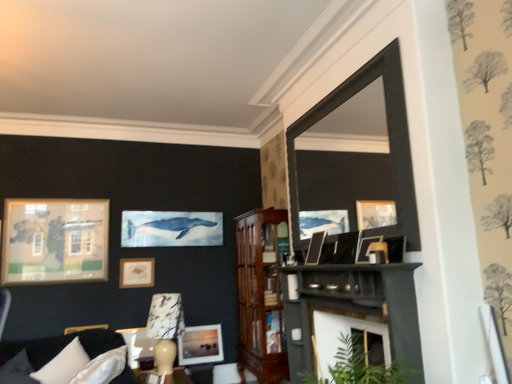
Question: Is matte black picture frame at upper center, the fifth picture frame from the bottom, taller than matte black picture frame at center, arranged as the 4th picture frame when viewed from the back?

Choices:
 (A) no
 (B) yes

Answer: (A)

Question: Can you confirm if matte black picture frame at upper center, the 5th picture frame in the left-to-right sequence, is positioned to the left of matte black picture frame at center, positioned as the second picture frame in right-to-left order?

Choices:
 (A) yes
 (B) no

Answer: (B)

Question: From the image's perspective, is matte black picture frame at upper center, which is counted as the 1th picture frame, starting from the top, on top of matte black picture frame at center, arranged as the 4th picture frame when viewed from the back?

Choices:
 (A) yes
 (B) no

Answer: (A)

Question: From a real-world perspective, is matte black picture frame at upper center, the 5th picture frame in the left-to-right sequence, on top of matte black picture frame at center, positioned as the second picture frame in front-to-back order?

Choices:
 (A) no
 (B) yes

Answer: (A)

Question: Can we say matte black picture frame at upper center, positioned as the 1th picture frame in front-to-back order, lies outside matte black picture frame at center, positioned as the second picture frame in right-to-left order?

Choices:
 (A) no
 (B) yes

Answer: (B)

Question: Considering the relative sizes of matte black picture frame at upper center, the fifth picture frame from the bottom, and matte black picture frame at center, which is the 4th picture frame from left to right, in the image provided, is matte black picture frame at upper center, the fifth picture frame from the bottom, wider than matte black picture frame at center, which is the 4th picture frame from left to right,?

Choices:
 (A) yes
 (B) no

Answer: (A)

Question: Is matte glass picture frame at center, the second picture frame positioned from the left, aimed at matte black picture frame at center, which is counted as the fourth picture frame, starting from the bottom?

Choices:
 (A) no
 (B) yes

Answer: (B)

Question: From a real-world perspective, is matte glass picture frame at center, acting as the 4th picture frame starting from the right, positioned under matte black picture frame at center, which is counted as the fourth picture frame, starting from the bottom, based on gravity?

Choices:
 (A) yes
 (B) no

Answer: (A)

Question: Does matte glass picture frame at center, which is the fifth picture frame from top to bottom, have a smaller size compared to matte black picture frame at center, which is counted as the fourth picture frame, starting from the bottom?

Choices:
 (A) yes
 (B) no

Answer: (B)

Question: Is matte black picture frame at center, arranged as the 4th picture frame when viewed from the back, at the back of matte glass picture frame at center, the second picture frame positioned from the left?

Choices:
 (A) yes
 (B) no

Answer: (B)

Question: Are matte glass picture frame at center, the second picture frame positioned from the left, and matte black picture frame at center, the 2th picture frame from the top, far apart?

Choices:
 (A) no
 (B) yes

Answer: (B)

Question: From a real-world perspective, is matte glass picture frame at center, which is the fifth picture frame from top to bottom, physically above matte black picture frame at center, which is counted as the fourth picture frame, starting from the bottom?

Choices:
 (A) yes
 (B) no

Answer: (B)

Question: Considering the relative sizes of matte gold picture frame at upper left, which is counted as the fifth picture frame, starting from the front, and dark gray fabric couch at lower left in the image provided, is matte gold picture frame at upper left, which is counted as the fifth picture frame, starting from the front, shorter than dark gray fabric couch at lower left?

Choices:
 (A) no
 (B) yes

Answer: (B)